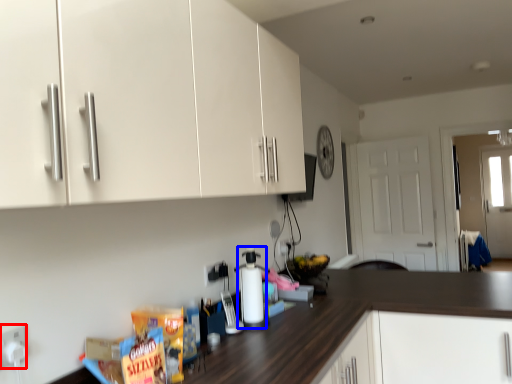
Question: Among these objects, which one is farthest to the camera, electric outlet (highlighted by a red box) or bottle (highlighted by a blue box)?

Choices:
 (A) electric outlet
 (B) bottle

Answer: (B)